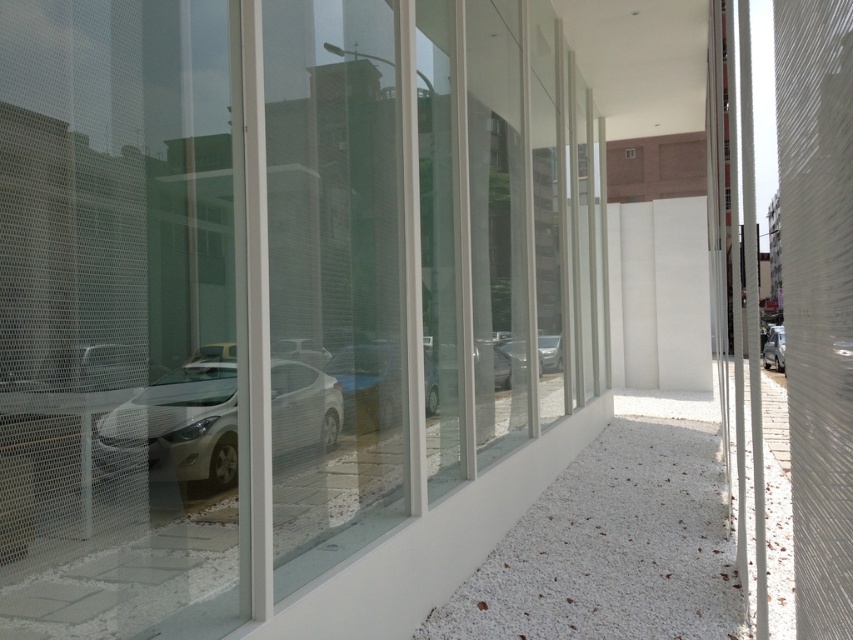
Find the location of a particular element. The image size is (853, 640). transparent glass door at center is located at coordinates (254, 289).

Is point (469, 404) closer to camera compared to point (776, 346)?

That is True.

Does point (433, 262) come behind point (773, 362)?

No, it is not.

Locate an element on the screen. The image size is (853, 640). transparent glass door at center is located at coordinates (254, 289).

Can you confirm if white glossy car at left is taller than metallic silver car at right?

No.

Between point (317, 438) and point (767, 349), which one is positioned in front?

Point (317, 438)

Locate an element on the screen. white glossy car at left is located at coordinates (177, 428).

Measure the distance from white glossy car at left to matte silver car at center.

white glossy car at left is 18.61 inches from matte silver car at center.

Which is above, white glossy car at left or matte silver car at center?

Positioned higher is matte silver car at center.

What do you see at coordinates (177, 428) in the screenshot?
I see `white glossy car at left` at bounding box center [177, 428].

Find the location of a particular element. white glossy car at left is located at coordinates (177, 428).